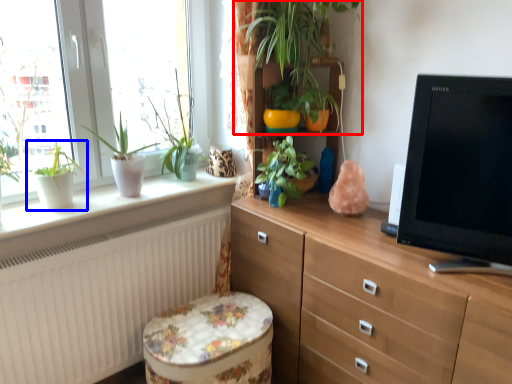
Question: Which point is further to the camera, houseplant (highlighted by a red box) or houseplant (highlighted by a blue box)?

Choices:
 (A) houseplant
 (B) houseplant

Answer: (B)